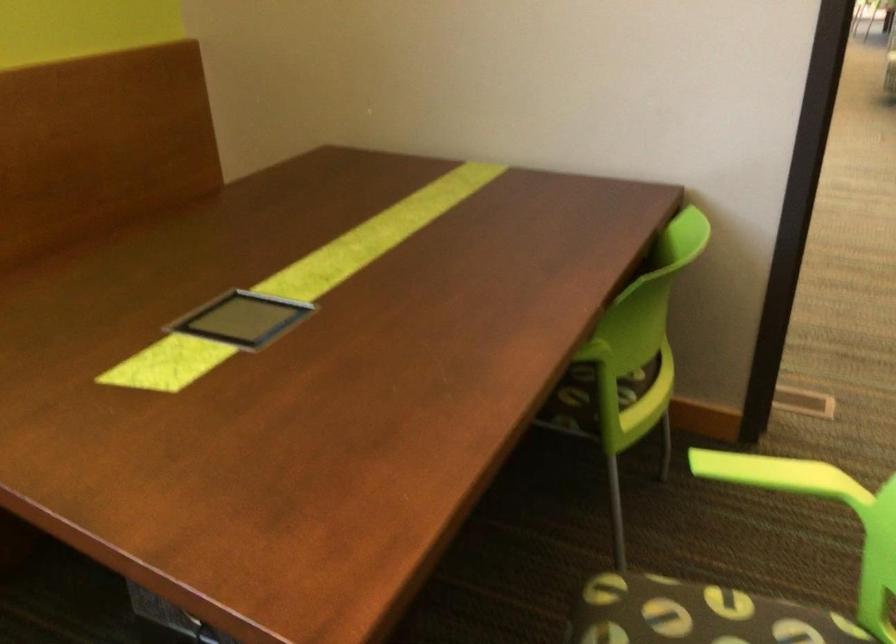
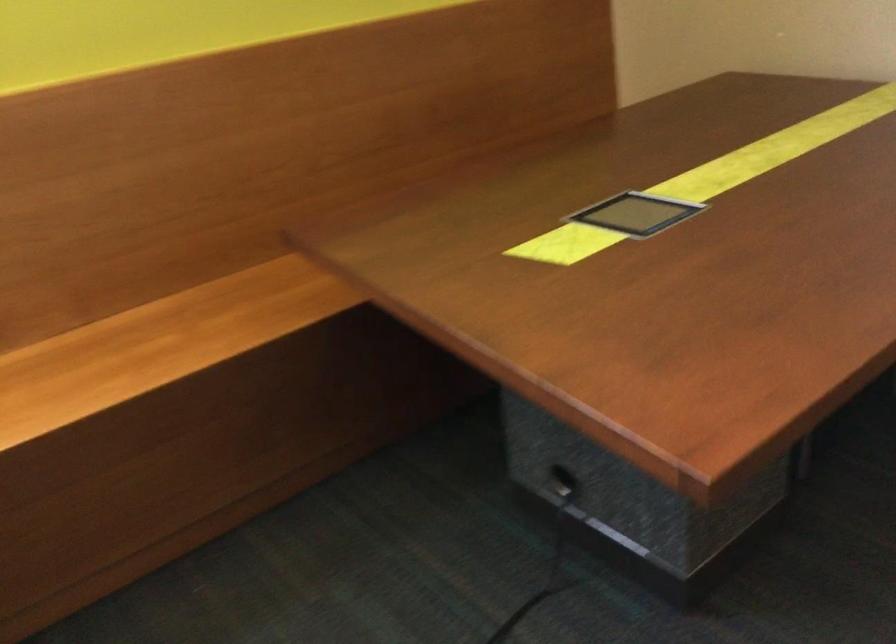
Question: The first image is from the beginning of the video and the second image is from the end. How did the camera likely rotate when shooting the video?

Choices:
 (A) Left
 (B) Right
 (C) Up
 (D) Down

Answer: (A)